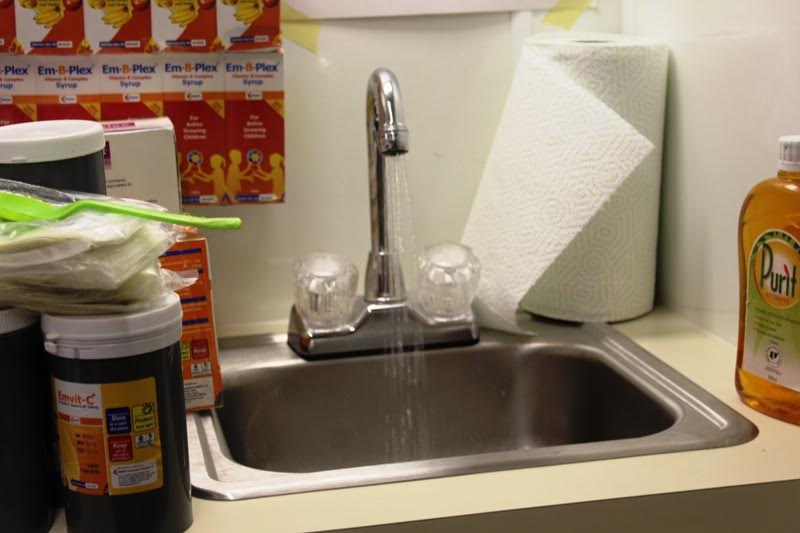
Locate an element on the screen. counter top is located at coordinates (626, 478).